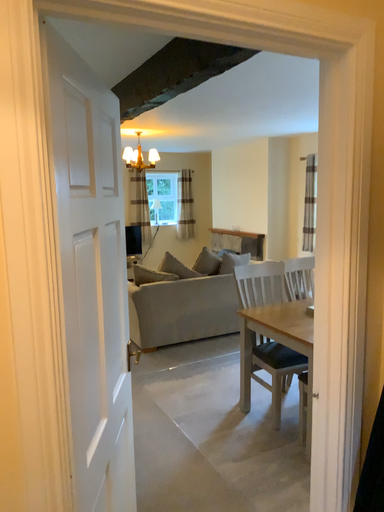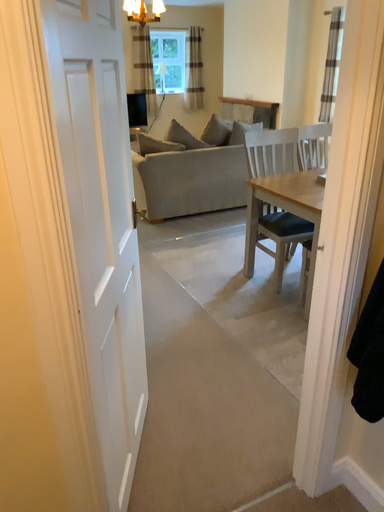
Question: Which way did the camera rotate in the video?

Choices:
 (A) rotated upward
 (B) rotated downward

Answer: (B)